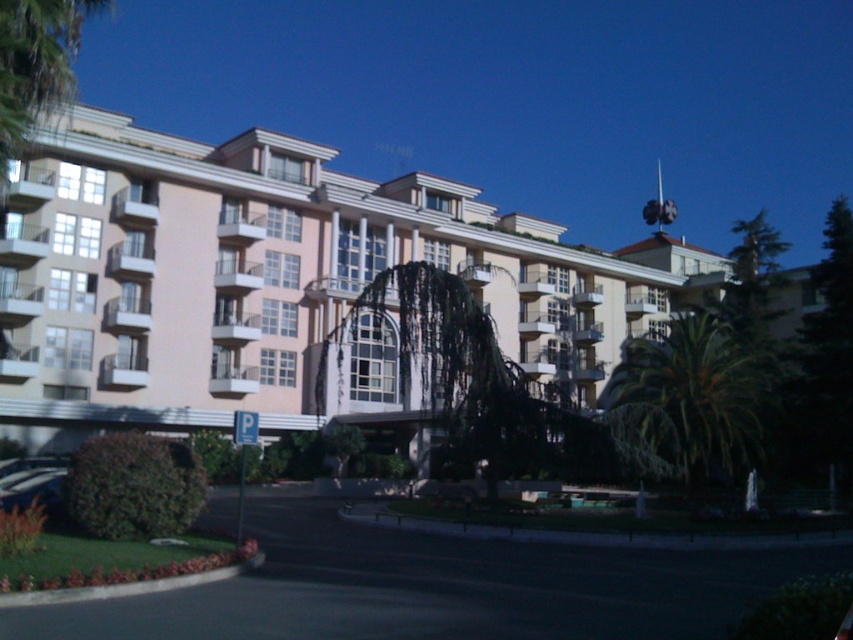
You are standing at the entrance of the building and see two points marked on the ground. The first point is at coordinates point (61,26) and the second is at point (45,500). Which point is closer to the entrance?

Point (61,26) is in front of point (45,500), so the first point is closer to the entrance.

You are standing in front of the building and want to walk from the entrance to the parking area. The entrance is marked by point (242, 163) and the parking area is marked by point (7, 499). Which direction should you walk to reach the parking area?

Since point (242, 163) is closer to you than point (7, 499), you should walk away from the building towards the parking area marked by point (7, 499).